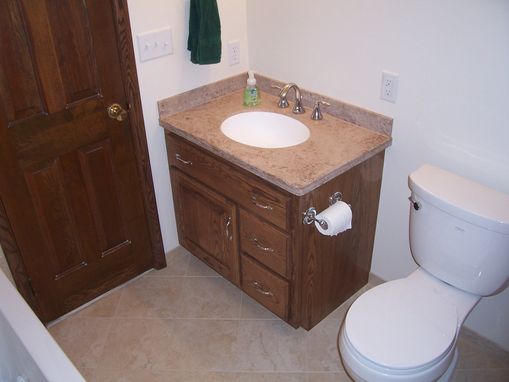
You are a GUI agent. You are given a task and a screenshot of the screen. Output one action in this format:
    pyautogui.click(x=<x>, y=<y>)
    Task: Click on the large rectangle drawer
    The image size is (509, 382).
    Given the screenshot: What is the action you would take?
    pyautogui.click(x=204, y=180)